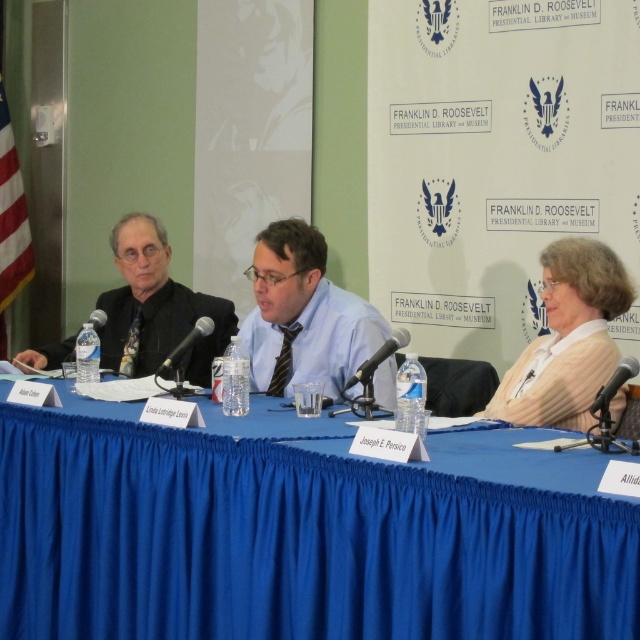
Is blue shirt at center taller than white sweater at right?

Yes.

Image resolution: width=640 pixels, height=640 pixels. I want to click on blue shirt at center, so click(x=304, y=316).

Can you confirm if white sweater at right is smaller than matte black suit at left?

Correct, white sweater at right occupies less space than matte black suit at left.

Is white sweater at right bigger than matte black suit at left?

Actually, white sweater at right might be smaller than matte black suit at left.

Between point (552, 250) and point (132, 236), which one is positioned behind?

Positioned behind is point (132, 236).

You are a GUI agent. You are given a task and a screenshot of the screen. Output one action in this format:
    pyautogui.click(x=<x>, y=<y>)
    Task: Click on the white sweater at right
    The width and height of the screenshot is (640, 640).
    Given the screenshot: What is the action you would take?
    pyautogui.click(x=566, y=339)

Is blue fabric table at center thinner than blue shirt at center?

No, blue fabric table at center is not thinner than blue shirt at center.

Is the position of blue fabric table at center more distant than that of blue shirt at center?

No, blue fabric table at center is in front of blue shirt at center.

Which is behind, point (401, 566) or point (275, 268)?

The point (275, 268) is more distant.

The image size is (640, 640). What are the coordinates of `blue fabric table at center` in the screenshot? It's located at [x=289, y=541].